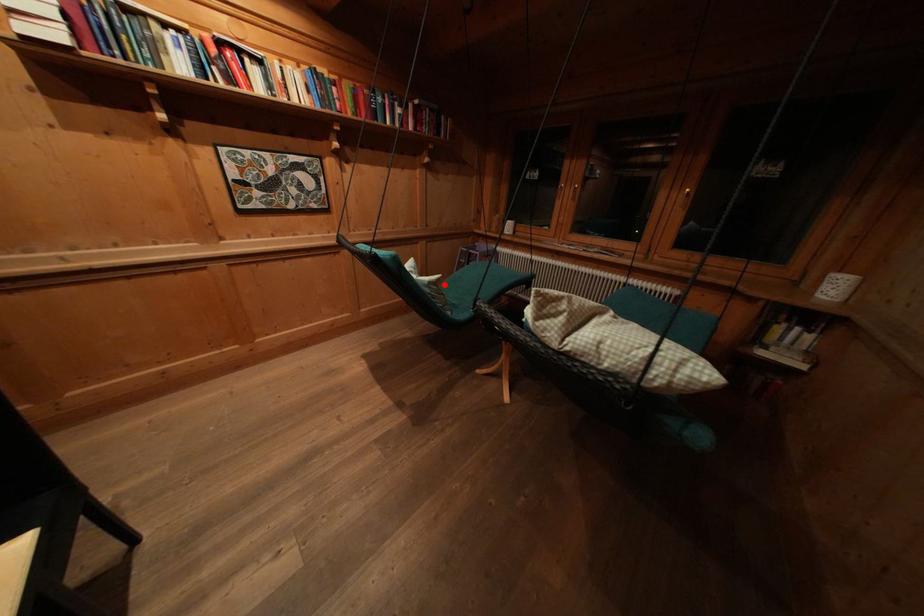
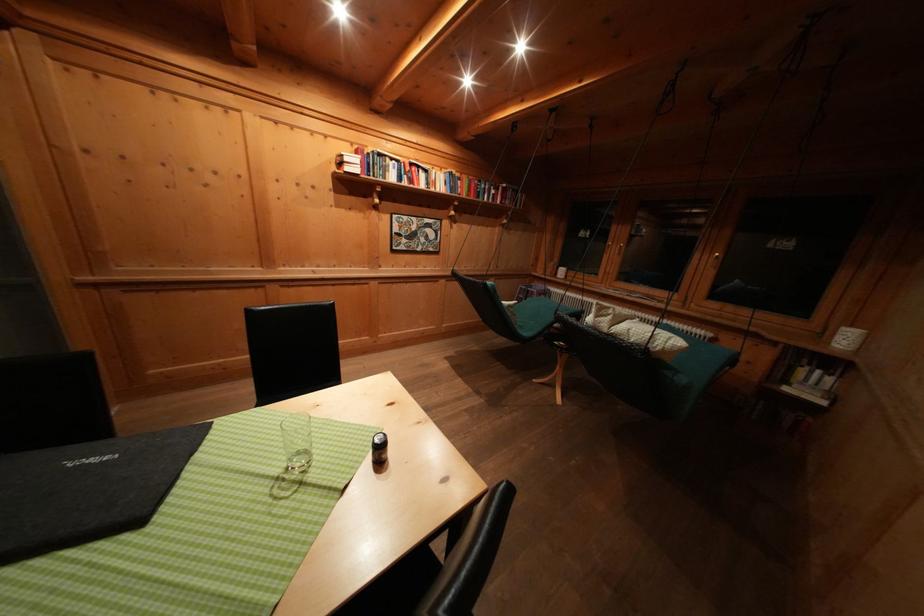
Question: I am providing you with two images of the same scene from different viewpoints. In image1, a red point is highlighted. Considering the same 3D point in image2, which of the following is correct?

Choices:
 (A) It is closer
 (B) It is farther

Answer: (B)